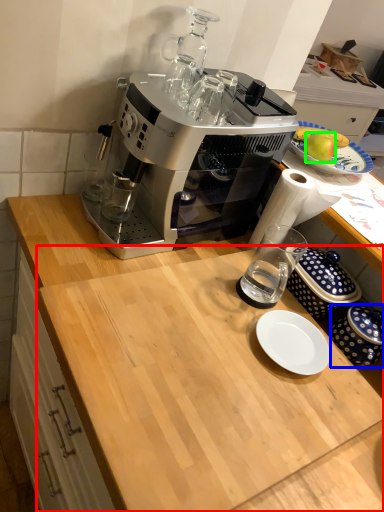
Question: Based on their relative distances, which object is nearer to counter top (highlighted by a red box)? Choose from tableware (highlighted by a blue box) and apple (highlighted by a green box).

Choices:
 (A) tableware
 (B) apple

Answer: (A)